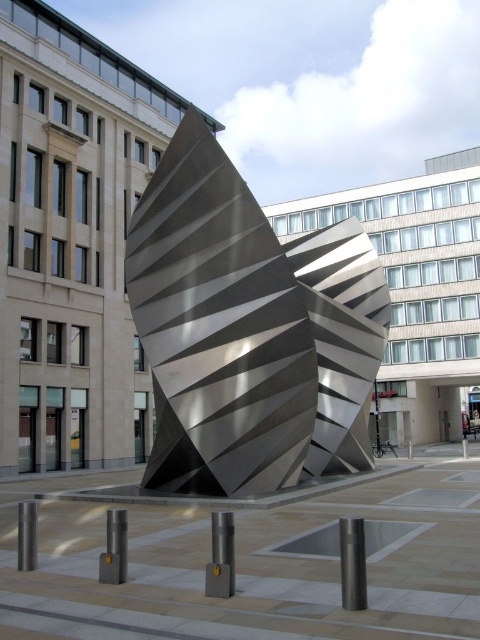
Does satin silver sculpture at center appear under polished metal pole at lower left?

Actually, satin silver sculpture at center is above polished metal pole at lower left.

Consider the image. Which of these two, satin silver sculpture at center or polished metal pole at lower left, stands taller?

satin silver sculpture at center

Describe the element at coordinates (249, 332) in the screenshot. I see `satin silver sculpture at center` at that location.

This screenshot has height=640, width=480. What are the coordinates of `satin silver sculpture at center` in the screenshot? It's located at (249, 332).

The image size is (480, 640). Find the location of `polished silver pole at center`. polished silver pole at center is located at coordinates (352, 563).

Where is `polished silver pole at center`? The image size is (480, 640). polished silver pole at center is located at coordinates (352, 563).

What are the coordinates of `polished silver pole at center` in the screenshot? It's located at point(352,563).

Is satin silver sculpture at center shorter than polished silver post at center?

Incorrect, satin silver sculpture at center's height does not fall short of polished silver post at center's.

Which is behind, point (235, 401) or point (214, 588)?

The point (235, 401) is more distant.

You are a GUI agent. You are given a task and a screenshot of the screen. Output one action in this format:
    pyautogui.click(x=<x>, y=<y>)
    Task: Click on the satin silver sculpture at center
    
    Given the screenshot: What is the action you would take?
    pyautogui.click(x=249, y=332)